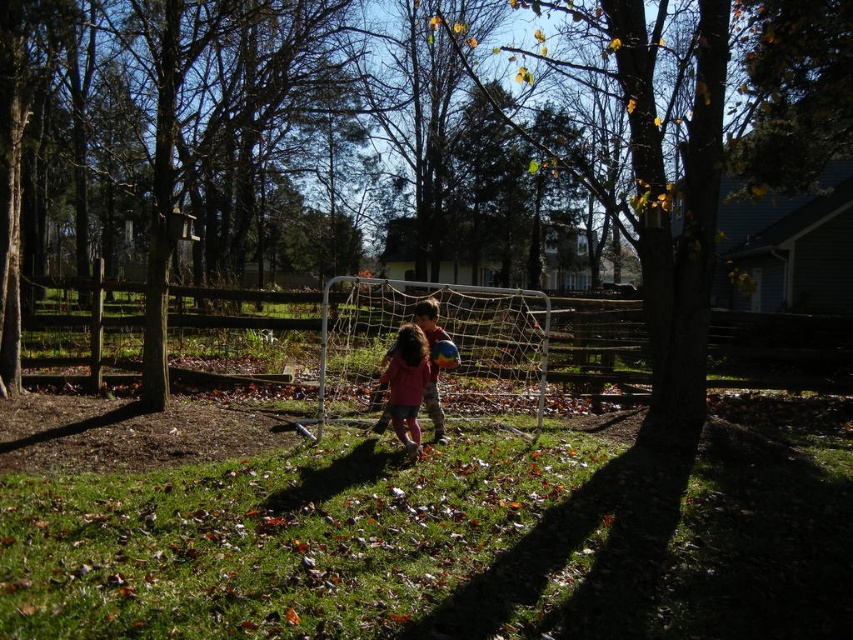
You are a photographer trying to capture a clear shot of the matte pink dress at center without the wooden fence at center blocking it. What should you do?

The wooden fence at center is in front of the matte pink dress at center, so you should move your camera position to the side or adjust the angle to avoid the fence blocking the view of the matte pink dress at center.

You are a photographer trying to capture a photo of the wooden fence at center and the matte pink dress at center in the same frame. Given that your camera has a maximum focus range of 15 feet, will both objects be in focus?

The wooden fence at center and the matte pink dress at center are 17.90 feet apart, which exceeds the camera maximum focus range of 15 feet. Therefore, both objects cannot be in focus at the same time.

You are a photographer setting up a shot of the wooden fence at center and the matte pink dress at center. Which object should you focus on first if you want to capture both in a single frame without moving the camera?

The wooden fence at center is larger in size than the matte pink dress at center, so you should focus on the wooden fence at center first to ensure it fills the frame appropriately before adjusting for the smaller matte pink dress at center.